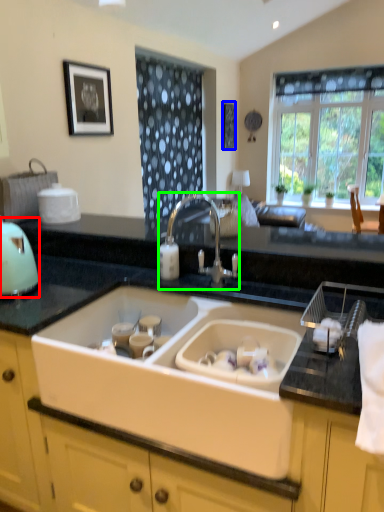
Question: Considering the real-world distances, which object is farthest from appliance (highlighted by a red box)? picture frame (highlighted by a blue box) or tap (highlighted by a green box)?

Choices:
 (A) picture frame
 (B) tap

Answer: (A)